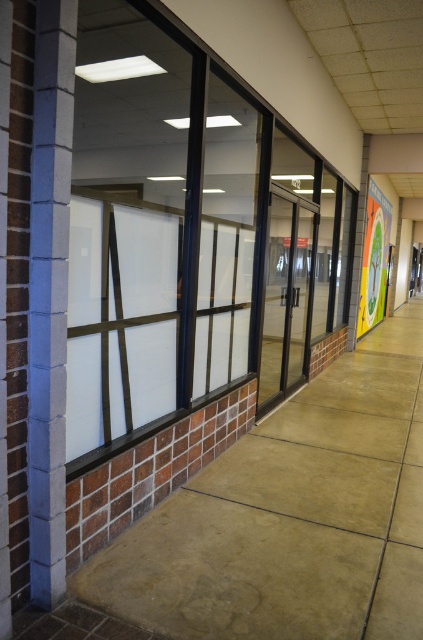
Question: Where is blue brick pillar at left located in relation to transparent glass door at center in the image?

Choices:
 (A) below
 (B) above

Answer: (A)

Question: Which object appears closest to the camera in this image?

Choices:
 (A) transparent glass door at center
 (B) blue brick pillar at left

Answer: (B)

Question: Considering the relative positions of blue brick pillar at left and transparent glass door at center in the image provided, where is blue brick pillar at left located with respect to transparent glass door at center?

Choices:
 (A) below
 (B) above

Answer: (A)

Question: Is blue brick pillar at left above transparent glass door at center?

Choices:
 (A) no
 (B) yes

Answer: (A)